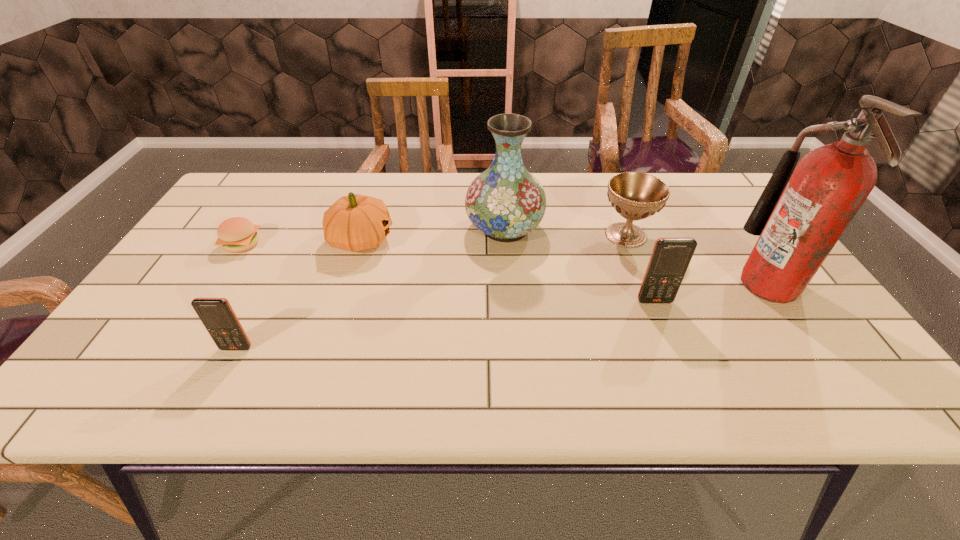
Find the location of a particular element. The width and height of the screenshot is (960, 540). free space between the leftmost object and the gourd is located at coordinates (301, 242).

At what (x,y) coordinates should I click in order to perform the action: click on free space between the fifth shortest object and the leftmost object. Please return your answer as a coordinate pair (x, y). This screenshot has height=540, width=960. Looking at the image, I should click on (448, 273).

You are a GUI agent. You are given a task and a screenshot of the screen. Output one action in this format:
    pyautogui.click(x=<x>, y=<y>)
    Task: Click on the free spot between the tallest object and the sixth object from right to left
    The width and height of the screenshot is (960, 540).
    Given the screenshot: What is the action you would take?
    pyautogui.click(x=503, y=316)

The height and width of the screenshot is (540, 960). In order to click on vacant area between the right cellular telephone and the fourth object from right to left in this screenshot , I will do `click(580, 265)`.

Where is `free space that is in between the third tallest object and the sixth shortest object`? The width and height of the screenshot is (960, 540). free space that is in between the third tallest object and the sixth shortest object is located at coordinates (580, 265).

Identify the location of empty location between the shortest object and the chalice. The width and height of the screenshot is (960, 540). (434, 240).

This screenshot has height=540, width=960. I want to click on empty location between the chalice and the second tallest object, so click(565, 232).

Where is `vacant area that lies between the chalice and the vase`? This screenshot has width=960, height=540. vacant area that lies between the chalice and the vase is located at coordinates (565, 232).

This screenshot has width=960, height=540. What are the coordinates of `object identified as the fifth closest to the gourd` in the screenshot? It's located at (670, 258).

Identify which object is the nearest to the taller cellular telephone. Please provide its 2D coordinates. Your answer should be formatted as a tuple, i.e. [(x, y)], where the tuple contains the x and y coordinates of a point satisfying the conditions above.

[(635, 196)]